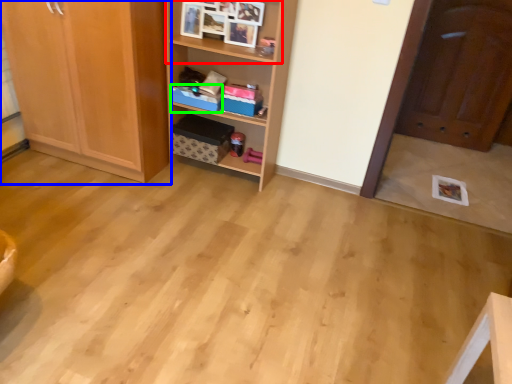
Question: Which object is the farthest from cabinet (highlighted by a red box)? Choose among these: cabinetry (highlighted by a blue box) or storage box (highlighted by a green box).

Choices:
 (A) cabinetry
 (B) storage box

Answer: (A)